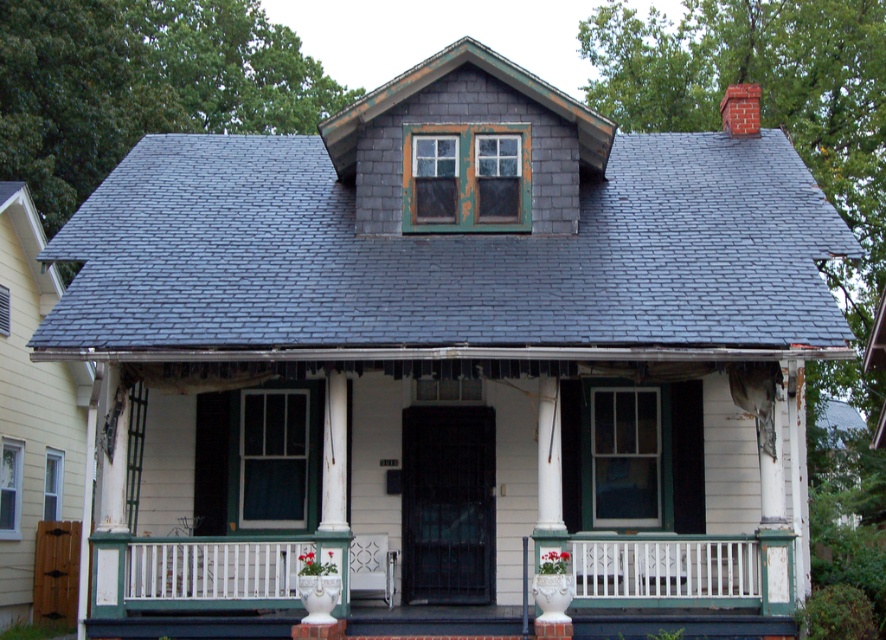
Image resolution: width=886 pixels, height=640 pixels. I want to click on white painted wood porch at center, so click(x=245, y=589).

What are the coordinates of `white painted wood porch at center` in the screenshot? It's located at (245, 589).